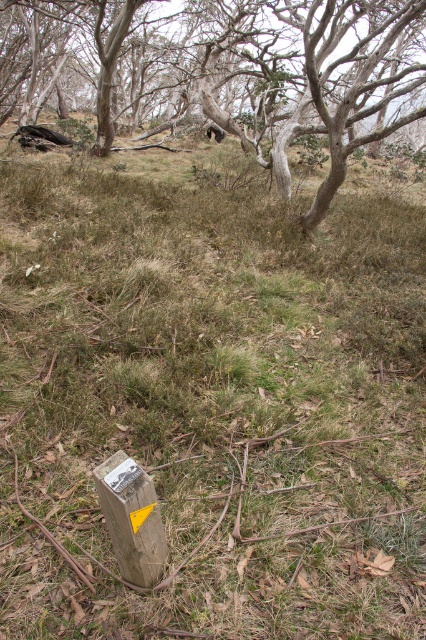
You are standing in the middle of the desolate landscape and see two points marked on the ground. The first point is at coordinates point (141, 483) and the second is at point (104, 476). Which point is closer to you?

Point (141, 483) is closer to you because it is further to the viewer than point (104, 476).

You are planning to place a new bench in the scene. The bench requires a space that is as wide as the smooth bark tree at center. Is there enough space next to the metallic silver sign at lower center for the bench?

The smooth bark tree at center has a larger size compared to the metallic silver sign at lower center. Therefore, the space next to the metallic silver sign at lower center may not be wide enough to accommodate the bench since the tree is larger than the sign.

Based on the scene description, where is the smooth bark tree at center located in terms of its 2D coordinates?

The smooth bark tree at center is located at the 2D coordinates of point (238, 68).